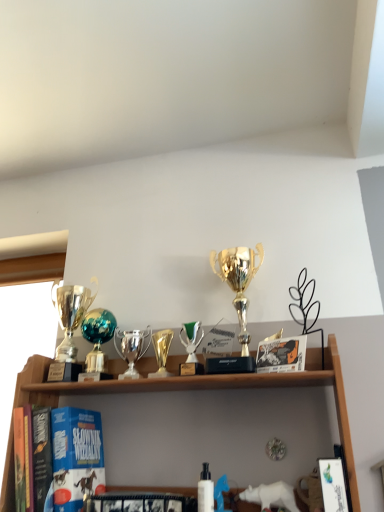
Describe the element at coordinates (333, 485) in the screenshot. I see `white glossy book at lower right, the second book viewed from the left` at that location.

Where is `green metallic trophy at center, marked as the second trophy in a right-to-left arrangement`? Image resolution: width=384 pixels, height=512 pixels. green metallic trophy at center, marked as the second trophy in a right-to-left arrangement is located at coordinates (191, 339).

What do you see at coordinates (205, 490) in the screenshot? The image size is (384, 512). I see `white matte bottle at center` at bounding box center [205, 490].

Locate an element on the screen. This screenshot has width=384, height=512. gold shiny trophy at left, the 1th trophy in the left-to-right sequence is located at coordinates (70, 315).

The height and width of the screenshot is (512, 384). Describe the element at coordinates (161, 352) in the screenshot. I see `gold metallic trophy at center` at that location.

This screenshot has width=384, height=512. In order to click on gold metallic trophy at center in this screenshot , I will do `click(161, 352)`.

What is the approximate height of hardcover book at center, which is the second book from right to left?

hardcover book at center, which is the second book from right to left, is 2.57 inches tall.

Describe the element at coordinates (131, 349) in the screenshot. Image resolution: width=384 pixels, height=512 pixels. I see `shiny silver trophy at center, which is counted as the 3th trophy, starting from the left` at that location.

Image resolution: width=384 pixels, height=512 pixels. In order to click on white glossy book at lower right, which is counted as the 2th book, starting from the back in this screenshot , I will do `click(333, 485)`.

Based on the photo, from a real-world perspective, is gold shiny trophy at left, the fifth trophy positioned from the right, located beneath teal metallic globe at center, the 2th trophy when ordered from left to right?

No, from a real-world perspective, gold shiny trophy at left, the fifth trophy positioned from the right, is not under teal metallic globe at center, the 2th trophy when ordered from left to right.

Considering the sizes of gold shiny trophy at left, the fifth trophy positioned from the right, and teal metallic globe at center, the 2th trophy when ordered from left to right, in the image, is gold shiny trophy at left, the fifth trophy positioned from the right, wider or thinner than teal metallic globe at center, the 2th trophy when ordered from left to right,?

Clearly, gold shiny trophy at left, the fifth trophy positioned from the right, has more width compared to teal metallic globe at center, the 2th trophy when ordered from left to right.

The height and width of the screenshot is (512, 384). I want to click on the 1st trophy positioned below the gold shiny trophy at left, the fifth trophy positioned from the right (from a real-world perspective), so click(97, 336).

Are hardcover book at center, which is counted as the first book, starting from the left, and gold metallic trophy at center far apart?

Actually, hardcover book at center, which is counted as the first book, starting from the left, and gold metallic trophy at center are a little close together.

Which is closer, (122, 502) or (171, 335)?

Point (122, 502) is closer to the camera than point (171, 335).

From a real-world perspective, does white matte bottle at center sit lower than gold metallic trophy at center?

Yes, from a real-world perspective, white matte bottle at center is below gold metallic trophy at center.

From the image's perspective, which is below, white matte bottle at center or gold metallic trophy at center?

white matte bottle at center is shown below in the image.

In the image, there is a gold metallic trophy at center. Where is `bottle below it (from a real-world perspective)`? This screenshot has width=384, height=512. bottle below it (from a real-world perspective) is located at coordinates (205, 490).

Which is in front, gold shiny trophy at left, the 1th trophy in the left-to-right sequence, or white matte bottle at center?

white matte bottle at center is in front.

This screenshot has width=384, height=512. What are the coordinates of `bottle lying below the gold shiny trophy at left, the 1th trophy in the left-to-right sequence (from the image's perspective)` in the screenshot? It's located at (205, 490).

Does point (73, 305) come closer to viewer compared to point (208, 505)?

No, it is not.

Does gold shiny trophy at left, the 1th trophy in the left-to-right sequence, have a greater height compared to white matte bottle at center?

Indeed, gold shiny trophy at left, the 1th trophy in the left-to-right sequence, has a greater height compared to white matte bottle at center.

Based on the photo, which object is thinner, hardcover book at center, arranged as the first book when viewed from the back, or gold shiny trophy at left, the 1th trophy in the left-to-right sequence?

With smaller width is hardcover book at center, arranged as the first book when viewed from the back.

What's the angular difference between hardcover book at center, which is counted as the first book, starting from the left, and gold shiny trophy at left, the 1th trophy in the left-to-right sequence,'s facing directions?

7.79 degrees separate the facing orientations of hardcover book at center, which is counted as the first book, starting from the left, and gold shiny trophy at left, the 1th trophy in the left-to-right sequence.

From the image's perspective, is hardcover book at center, which is the second book from right to left, located above or below gold shiny trophy at left, the 1th trophy in the left-to-right sequence?

Based on their image positions, hardcover book at center, which is the second book from right to left, is located beneath gold shiny trophy at left, the 1th trophy in the left-to-right sequence.

Consider the image. Is hardcover book at center, which is counted as the first book, starting from the left, oriented away from gold shiny trophy at left, the fifth trophy positioned from the right?

No, gold shiny trophy at left, the fifth trophy positioned from the right, is not at the back of hardcover book at center, which is counted as the first book, starting from the left.

From a real-world perspective, is white matte bottle at center below gold shiny trophy at center, the 1th trophy in the right-to-left sequence?

Yes, from a real-world perspective, white matte bottle at center is beneath gold shiny trophy at center, the 1th trophy in the right-to-left sequence.

Is white matte bottle at center oriented away from gold shiny trophy at center, which is the fifth trophy in left-to-right order?

No, white matte bottle at center is not facing away from gold shiny trophy at center, which is the fifth trophy in left-to-right order.

Is white matte bottle at center wider or thinner than gold shiny trophy at center, which is the fifth trophy in left-to-right order?

In the image, white matte bottle at center appears to be more narrow than gold shiny trophy at center, which is the fifth trophy in left-to-right order.

Is white matte bottle at center closer to the viewer compared to shiny silver trophy at center, which is counted as the 3th trophy, starting from the left?

Yes.

From the picture: Does white matte bottle at center have a greater width compared to shiny silver trophy at center, the 3th trophy when ordered from right to left?

No.

From a real-world perspective, is white matte bottle at center over shiny silver trophy at center, which is counted as the 3th trophy, starting from the left?

No, from a real-world perspective, white matte bottle at center is not over shiny silver trophy at center, which is counted as the 3th trophy, starting from the left

At what (x,y) coordinates should I click in order to perform the action: click on bottle below the shiny silver trophy at center, the 3th trophy when ordered from right to left (from a real-world perspective). Please return your answer as a coordinate pair (x, y). This screenshot has height=512, width=384. Looking at the image, I should click on (205, 490).

From the image's perspective, starting from the teal metallic globe at center, the 2th trophy when ordered from left to right, which trophy is the 2nd one above? Please provide its 2D coordinates.

[(70, 315)]

This screenshot has height=512, width=384. In order to click on the 1st book in front when counting from the gold metallic trophy at center in this screenshot , I will do `click(139, 503)`.

Looking at the image, which one is located closer to gold metallic trophy at center, white matte bottle at center or hardcover book at center, the 2th book from the front?

white matte bottle at center.

Estimate the real-world distances between objects in this image. Which object is closer to white matte bottle at center, green metallic trophy at center, the 4th trophy viewed from the left, or shiny silver trophy at center, the 3th trophy when ordered from right to left?

Among the two, green metallic trophy at center, the 4th trophy viewed from the left, is located nearer to white matte bottle at center.

Looking at the image, which one is located further to green metallic trophy at center, the 4th trophy viewed from the left, gold metallic trophy at center or teal metallic globe at center, the 2th trophy when ordered from left to right?

Based on the image, teal metallic globe at center, the 2th trophy when ordered from left to right, appears to be further to green metallic trophy at center, the 4th trophy viewed from the left.

From the image, which object appears to be farther from teal metallic globe at center, the 2th trophy when ordered from left to right, gold shiny trophy at left, the 1th trophy in the left-to-right sequence, or gold shiny trophy at center, the 1th trophy in the right-to-left sequence?

Based on the image, gold shiny trophy at center, the 1th trophy in the right-to-left sequence, appears to be further to teal metallic globe at center, the 2th trophy when ordered from left to right.

Which object lies further to the anchor point hardcover book at center, which is counted as the first book, starting from the left, gold metallic trophy at center or white glossy book at lower right, acting as the 1th book starting from the front?

white glossy book at lower right, acting as the 1th book starting from the front.

When comparing their distances from gold metallic trophy at center, does shiny silver trophy at center, which is counted as the 3th trophy, starting from the left, or gold shiny trophy at left, the fifth trophy positioned from the right, seem closer?

shiny silver trophy at center, which is counted as the 3th trophy, starting from the left, is positioned closer to the anchor gold metallic trophy at center.

Considering their positions, is shiny silver trophy at center, which is counted as the 3th trophy, starting from the left, positioned closer to white matte bottle at center than white glossy book at lower right, which is counted as the 2th book, starting from the back?

white glossy book at lower right, which is counted as the 2th book, starting from the back.

Looking at the image, which one is located further to white matte bottle at center, gold shiny trophy at center, which is the fifth trophy in left-to-right order, or gold shiny trophy at left, the 1th trophy in the left-to-right sequence?

gold shiny trophy at left, the 1th trophy in the left-to-right sequence.

Where is `bottle between green metallic trophy at center, the 4th trophy viewed from the left, and hardcover book at center, which is the second book from right to left, vertically`? Image resolution: width=384 pixels, height=512 pixels. bottle between green metallic trophy at center, the 4th trophy viewed from the left, and hardcover book at center, which is the second book from right to left, vertically is located at coordinates (205, 490).

Find the location of a particular element. Image resolution: width=384 pixels, height=512 pixels. bottle between gold metallic trophy at center and hardcover book at center, arranged as the first book when viewed from the back, in the up-down direction is located at coordinates (205, 490).

This screenshot has height=512, width=384. In order to click on candle holder between teal metallic globe at center, the 2th trophy when ordered from left to right, and green metallic trophy at center, marked as the second trophy in a right-to-left arrangement in this screenshot , I will do `click(161, 352)`.

Identify the location of trophy situated between gold shiny trophy at left, the fifth trophy positioned from the right, and shiny silver trophy at center, which is counted as the 3th trophy, starting from the left, from left to right. (97, 336).